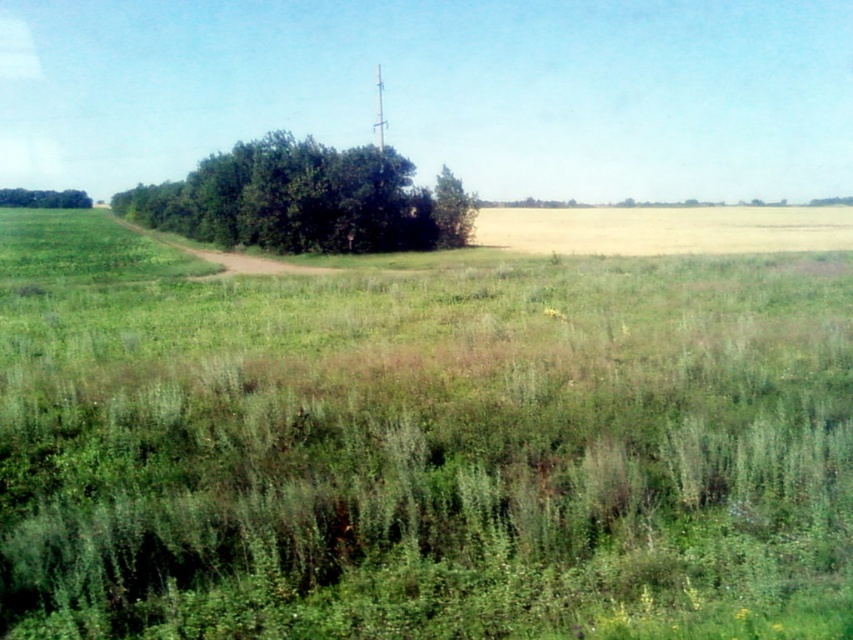
Question: Among these points, which one is farthest from the camera?

Choices:
 (A) (254, 216)
 (B) (84, 196)

Answer: (B)

Question: Where is green leafy tree at center located in relation to green leafy tree at left in the image?

Choices:
 (A) left
 (B) right

Answer: (B)

Question: Does green leafy tree at center lie in front of green leafy tree at left?

Choices:
 (A) no
 (B) yes

Answer: (B)

Question: Among these points, which one is nearest to the camera?

Choices:
 (A) (13, 198)
 (B) (405, 182)

Answer: (B)

Question: Does green leafy tree at center have a smaller size compared to green leafy tree at left?

Choices:
 (A) no
 (B) yes

Answer: (A)

Question: Which of the following is the closest to the observer?

Choices:
 (A) green leafy tree at center
 (B) green leafy tree at left

Answer: (A)